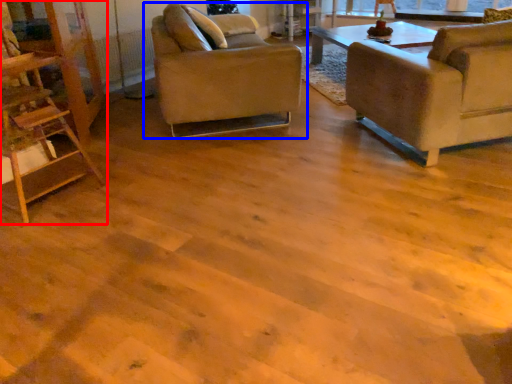
Question: Which of the following is the closest to the observer, ladder (highlighted by a red box) or chair (highlighted by a blue box)?

Choices:
 (A) ladder
 (B) chair

Answer: (A)